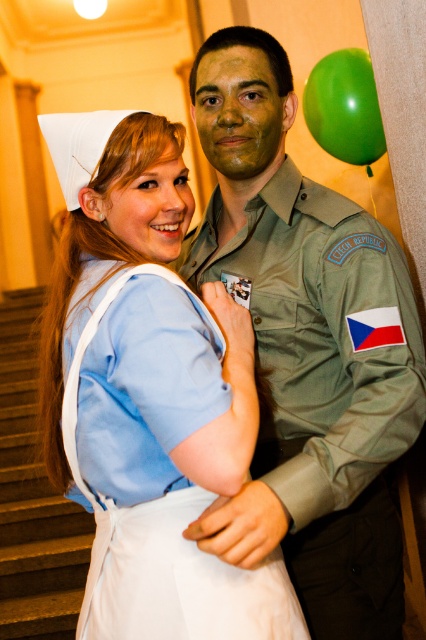
Question: Which object is positioned farthest from the green rubber balloon at upper right?

Choices:
 (A) matte green uniform at center
 (B) light blue fabric nurse uniform at center

Answer: (B)

Question: Which object is the farthest from the green rubber balloon at upper right?

Choices:
 (A) matte green uniform at center
 (B) light blue fabric nurse uniform at center

Answer: (B)

Question: Considering the relative positions of matte green uniform at center and green rubber balloon at upper right in the image provided, where is matte green uniform at center located with respect to green rubber balloon at upper right?

Choices:
 (A) left
 (B) right

Answer: (A)

Question: Does matte green uniform at center come behind green rubber balloon at upper right?

Choices:
 (A) no
 (B) yes

Answer: (A)

Question: Which object is the farthest from the matte green uniform at center?

Choices:
 (A) green rubber balloon at upper right
 (B) light blue fabric nurse uniform at center

Answer: (A)

Question: Is light blue fabric nurse uniform at center below green rubber balloon at upper right?

Choices:
 (A) yes
 (B) no

Answer: (A)